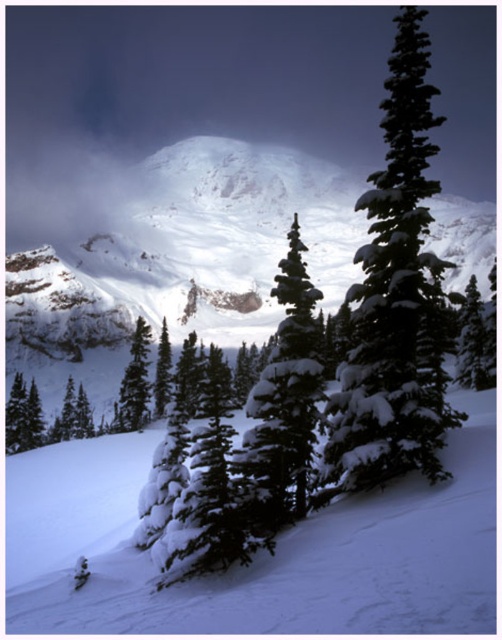
Describe the element at coordinates (135, 381) in the screenshot. The width and height of the screenshot is (502, 640). I see `snow-covered pine tree at center-left` at that location.

Does snow-covered pine tree at center-left appear over green matte evergreen tree at center-left?

Indeed, snow-covered pine tree at center-left is positioned over green matte evergreen tree at center-left.

Who is more distant from viewer, (148, 324) or (78, 426)?

Point (148, 324)

Identify the location of snow-covered pine tree at center-left. The width and height of the screenshot is (502, 640). (135, 381).

Is snowy pine trees at lower center bigger than snowy granite mountain at upper center?

No.

Is point (218, 593) behind point (263, 269)?

No.

At what (x,y) coordinates should I click in order to perform the action: click on snowy pine trees at lower center. Please return your answer as a coordinate pair (x, y). The height and width of the screenshot is (640, 502). Looking at the image, I should click on (262, 556).

I want to click on snowy pine trees at lower center, so click(x=262, y=556).

Is snow-covered evergreen at center-right positioned behind green matte evergreen tree at center?

No, it is not.

Does snow-covered evergreen at center-right appear on the left side of green matte evergreen tree at center?

Incorrect, snow-covered evergreen at center-right is not on the left side of green matte evergreen tree at center.

The image size is (502, 640). In order to click on snow-covered evergreen at center-right in this screenshot , I will do `click(393, 294)`.

I want to click on snow-covered evergreen at center-right, so click(393, 294).